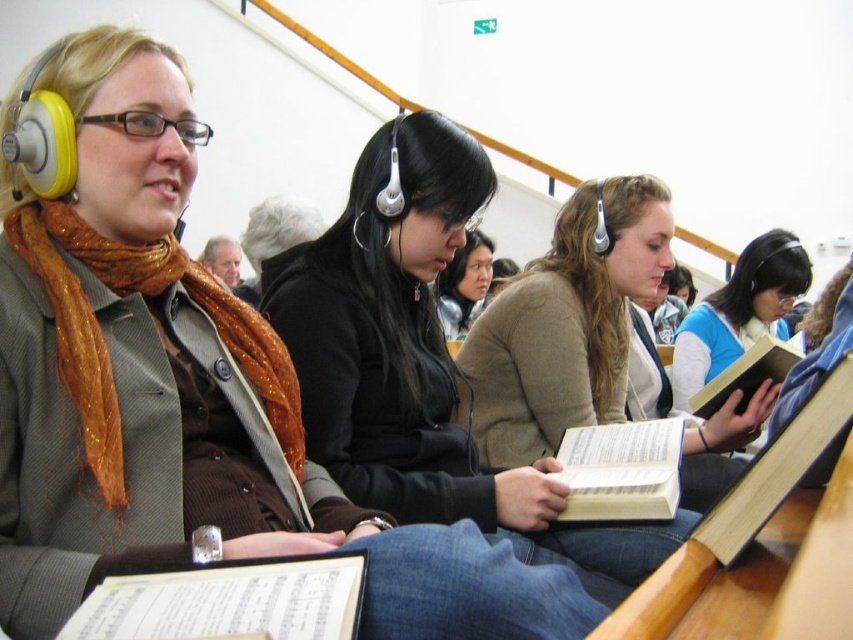
Consider the image. Does matte black jacket at center appear under hardcover book at center?

No, matte black jacket at center is not below hardcover book at center.

Is matte black jacket at center smaller than hardcover book at center?

No, matte black jacket at center is not smaller than hardcover book at center.

Describe the element at coordinates (463, 284) in the screenshot. Image resolution: width=853 pixels, height=640 pixels. I see `matte black jacket at center` at that location.

Identify the location of matte black jacket at center. The height and width of the screenshot is (640, 853). (463, 284).

Between white paper book at lower left and white paper book at center, which one appears on the right side from the viewer's perspective?

From the viewer's perspective, white paper book at center appears more on the right side.

Between white paper book at lower left and white paper book at center, which one is positioned lower?

white paper book at lower left is lower down.

Which is behind, point (297, 600) or point (665, 465)?

Point (665, 465)

The image size is (853, 640). What are the coordinates of `white paper book at lower left` in the screenshot? It's located at (228, 602).

Is blue matte shirt at center above hardcover book at center?

Indeed, blue matte shirt at center is positioned over hardcover book at center.

Is blue matte shirt at center wider than hardcover book at center?

Yes.

At what (x,y) coordinates should I click in order to perform the action: click on blue matte shirt at center. Please return your answer as a coordinate pair (x, y). This screenshot has width=853, height=640. Looking at the image, I should click on (740, 310).